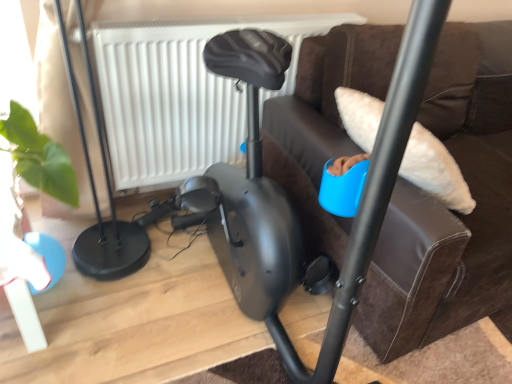
Where is `white textured radiator at upper center`? This screenshot has width=512, height=384. white textured radiator at upper center is located at coordinates (180, 95).

Describe the element at coordinates (180, 95) in the screenshot. I see `white textured radiator at upper center` at that location.

What is the approximate width of white textured radiator at upper center?

white textured radiator at upper center is 5.05 inches in width.

What is the approximate height of black matte exercise bike at center?

It is 33.57 inches.

This screenshot has width=512, height=384. Identify the location of black matte exercise bike at center. click(449, 210).

Describe the element at coordinates (449, 210) in the screenshot. The width and height of the screenshot is (512, 384). I see `black matte exercise bike at center` at that location.

I want to click on white textured radiator at upper center, so click(180, 95).

Does black matte exercise bike at center appear on the left side of white textured radiator at upper center?

In fact, black matte exercise bike at center is to the right of white textured radiator at upper center.

Is the depth of black matte exercise bike at center less than that of white textured radiator at upper center?

That is True.

Which point is more forward, (x=497, y=188) or (x=234, y=114)?

Positioned in front is point (x=497, y=188).

From the image's perspective, which one is positioned higher, black matte exercise bike at center or white textured radiator at upper center?

From the image's view, white textured radiator at upper center is above.

From a real-world perspective, is black matte exercise bike at center over white textured radiator at upper center?

Correct, in the physical world, black matte exercise bike at center is higher than white textured radiator at upper center.

Considering the relative sizes of black matte exercise bike at center and white textured radiator at upper center in the image provided, is black matte exercise bike at center thinner than white textured radiator at upper center?

No, black matte exercise bike at center is not thinner than white textured radiator at upper center.

Does black matte exercise bike at center have a lesser height compared to white textured radiator at upper center?

No, black matte exercise bike at center is not shorter than white textured radiator at upper center.

Can you confirm if black matte exercise bike at center is smaller than white textured radiator at upper center?

Incorrect, black matte exercise bike at center is not smaller in size than white textured radiator at upper center.

Is black matte exercise bike at center located outside white textured radiator at upper center?

Yes, black matte exercise bike at center is outside of white textured radiator at upper center.

Are black matte exercise bike at center and white textured radiator at upper center far apart?

No, black matte exercise bike at center is in close proximity to white textured radiator at upper center.

Is black matte exercise bike at center aimed at white textured radiator at upper center?

No.

How different are the orientations of black matte exercise bike at center and white textured radiator at upper center in degrees?

They differ by 1.79 degrees in their facing directions.

Where is `radiator on the left of the black matte exercise bike at center`? The image size is (512, 384). radiator on the left of the black matte exercise bike at center is located at coordinates (180, 95).

Which object is positioned more to the right, white textured radiator at upper center or black matte exercise bike at center?

black matte exercise bike at center is more to the right.

Considering the positions of objects white textured radiator at upper center and black matte exercise bike at center in the image provided, who is behind, white textured radiator at upper center or black matte exercise bike at center?

Positioned behind is white textured radiator at upper center.

Considering the positions of point (168, 171) and point (339, 129), is point (168, 171) closer or farther from the camera than point (339, 129)?

Point (168, 171).

From the image's perspective, which is above, white textured radiator at upper center or black matte exercise bike at center?

white textured radiator at upper center appears higher in the image.

From a real-world perspective, which is physically above, white textured radiator at upper center or black matte exercise bike at center?

From a 3D spatial view, black matte exercise bike at center is above.

From the picture: Does white textured radiator at upper center have a lesser width compared to black matte exercise bike at center?

Yes.

Looking at this image, is white textured radiator at upper center shorter than black matte exercise bike at center?

Yes.

Considering the sizes of objects white textured radiator at upper center and black matte exercise bike at center in the image provided, who is bigger, white textured radiator at upper center or black matte exercise bike at center?

black matte exercise bike at center is bigger.

Is white textured radiator at upper center situated inside black matte exercise bike at center or outside?

The correct answer is: outside.

In the scene shown: Does white textured radiator at upper center touch black matte exercise bike at center?

There is a gap between white textured radiator at upper center and black matte exercise bike at center.

Is white textured radiator at upper center oriented towards black matte exercise bike at center?

No, white textured radiator at upper center is not aimed at black matte exercise bike at center.

What are the coordinates of `radiator on the left of the black matte exercise bike at center` in the screenshot? It's located at (180, 95).

This screenshot has width=512, height=384. Find the location of `furniture above the white textured radiator at upper center (from a real-world perspective)`. furniture above the white textured radiator at upper center (from a real-world perspective) is located at coordinates (449, 210).

This screenshot has height=384, width=512. In order to click on radiator on the left of black matte exercise bike at center in this screenshot , I will do click(180, 95).